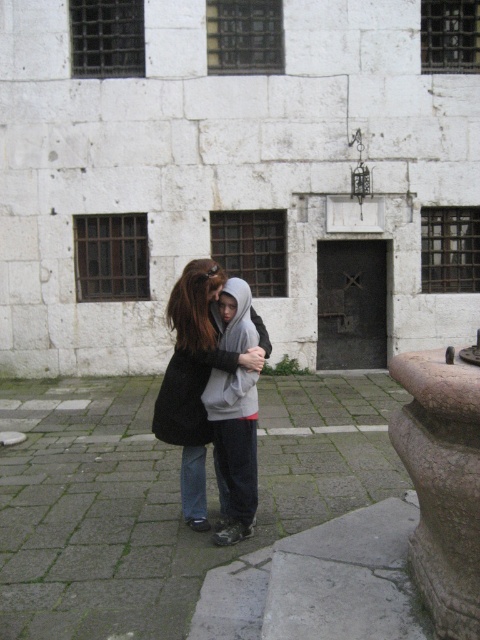
Is brown stone pillar at lower right to the left of dark gray hoodie at center from the viewer's perspective?

No, brown stone pillar at lower right is not to the left of dark gray hoodie at center.

Is brown stone pillar at lower right positioned at the back of dark gray hoodie at center?

No, it is in front of dark gray hoodie at center.

The image size is (480, 640). Identify the location of brown stone pillar at lower right. (443, 483).

At what (x,y) coordinates should I click in order to perform the action: click on brown stone pillar at lower right. Please return your answer as a coordinate pair (x, y). This screenshot has width=480, height=640. Looking at the image, I should click on (443, 483).